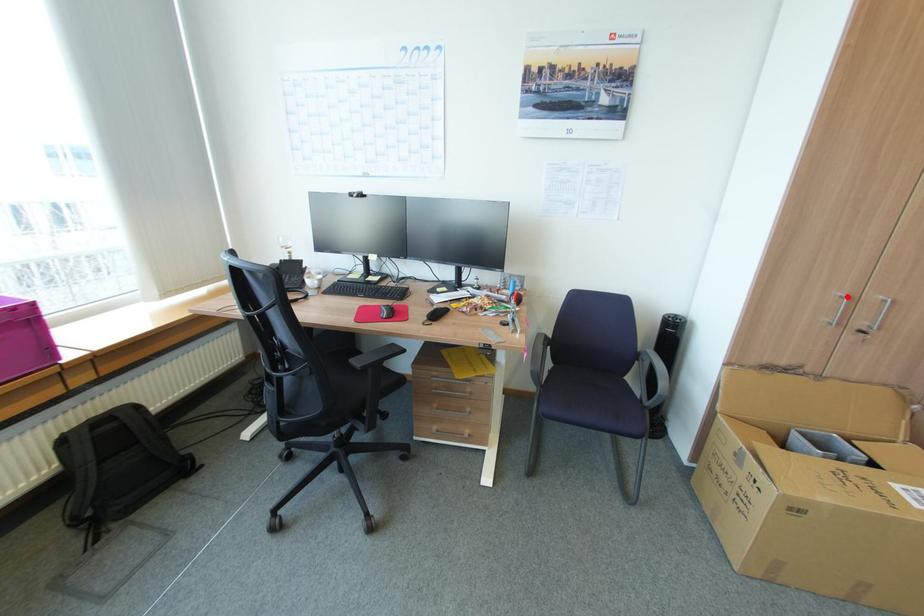
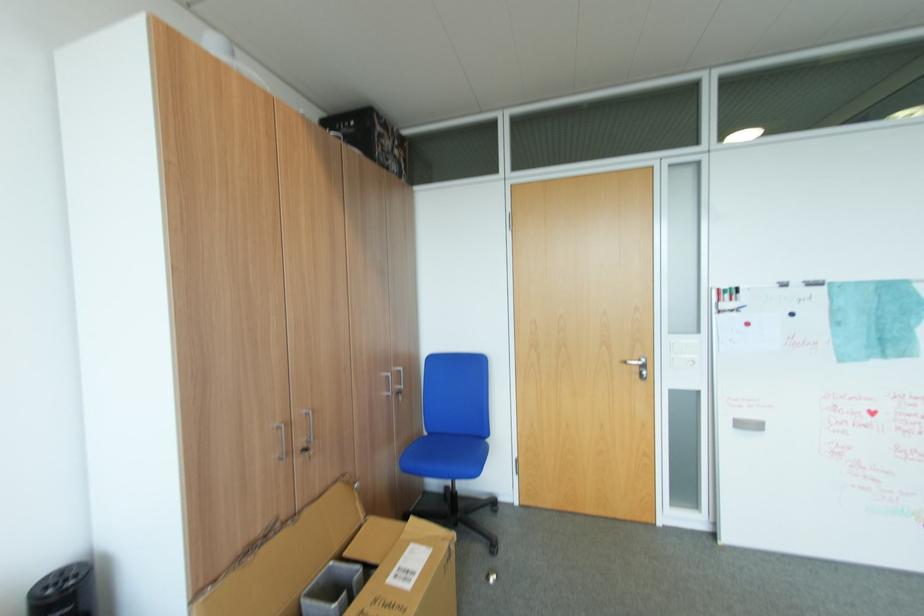
Find the pixel in the second image that matches the highlighted location in the first image.

(283, 430)